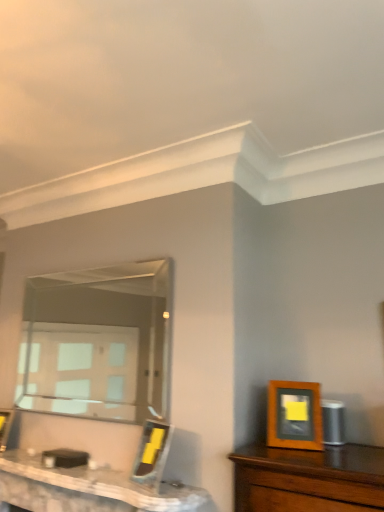
Question: Is the depth of wooden picture frame at right, arranged as the first picture frame when viewed from the front, greater than that of wooden picture frame at center, arranged as the first picture frame when viewed from the back?

Choices:
 (A) no
 (B) yes

Answer: (A)

Question: Would you say wooden picture frame at right, arranged as the first picture frame when viewed from the front, contains wooden picture frame at center, the 3th picture frame when ordered from right to left?

Choices:
 (A) yes
 (B) no

Answer: (B)

Question: Is wooden picture frame at right, which ranks as the 3th picture frame in left-to-right order, facing towards wooden picture frame at center, which is the third picture frame in front-to-back order?

Choices:
 (A) no
 (B) yes

Answer: (A)

Question: Is wooden picture frame at right, which is the first picture frame in right-to-left order, smaller than wooden picture frame at center, the 3th picture frame when ordered from right to left?

Choices:
 (A) yes
 (B) no

Answer: (A)

Question: From a real-world perspective, does wooden picture frame at right, which ranks as the 3th picture frame in left-to-right order, sit lower than wooden picture frame at center, arranged as the first picture frame when viewed from the back?

Choices:
 (A) no
 (B) yes

Answer: (A)

Question: From the image's perspective, relative to wooden picture frame at center, the 3th picture frame when ordered from right to left, is clear glass mirror at center above or below?

Choices:
 (A) below
 (B) above

Answer: (B)

Question: In the image, is clear glass mirror at center positioned in front of or behind wooden picture frame at center, which is the first picture frame in left-to-right order?

Choices:
 (A) front
 (B) behind

Answer: (A)

Question: Visually, is clear glass mirror at center positioned to the left or to the right of wooden picture frame at center, the 3th picture frame when ordered from right to left?

Choices:
 (A) left
 (B) right

Answer: (B)

Question: From a real-world perspective, is clear glass mirror at center physically located above or below wooden picture frame at center, which is the first picture frame in left-to-right order?

Choices:
 (A) below
 (B) above

Answer: (B)

Question: Considering the positions of point (294, 411) and point (1, 434), is point (294, 411) closer or farther from the camera than point (1, 434)?

Choices:
 (A) farther
 (B) closer

Answer: (B)

Question: From their relative heights in the image, would you say wooden picture frame at right, which is the first picture frame in right-to-left order, is taller or shorter than wooden picture frame at center, the 3th picture frame when ordered from right to left?

Choices:
 (A) short
 (B) tall

Answer: (B)

Question: Is wooden picture frame at right, which is the 3th picture frame from back to front, wider or thinner than wooden picture frame at center, which is the third picture frame in front-to-back order?

Choices:
 (A) wide
 (B) thin

Answer: (B)

Question: In terms of size, does wooden picture frame at right, which ranks as the 3th picture frame in left-to-right order, appear bigger or smaller than wooden picture frame at center, the 3th picture frame when ordered from right to left?

Choices:
 (A) small
 (B) big

Answer: (A)

Question: Is point (13, 412) closer or farther from the camera than point (271, 426)?

Choices:
 (A) closer
 (B) farther

Answer: (B)

Question: From a real-world perspective, is wooden picture frame at center, which is the first picture frame in left-to-right order, above or below wooden picture frame at right, which is the first picture frame in right-to-left order?

Choices:
 (A) above
 (B) below

Answer: (B)